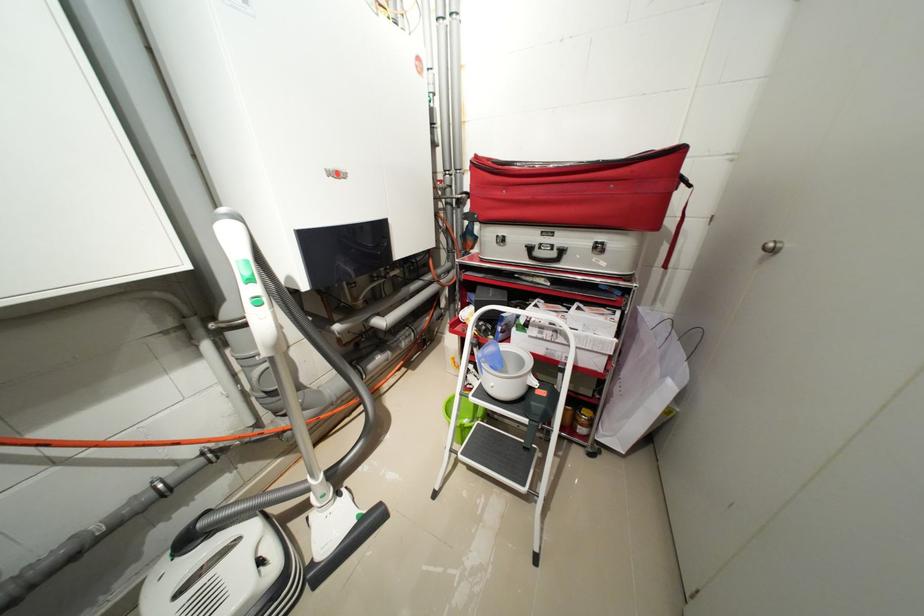
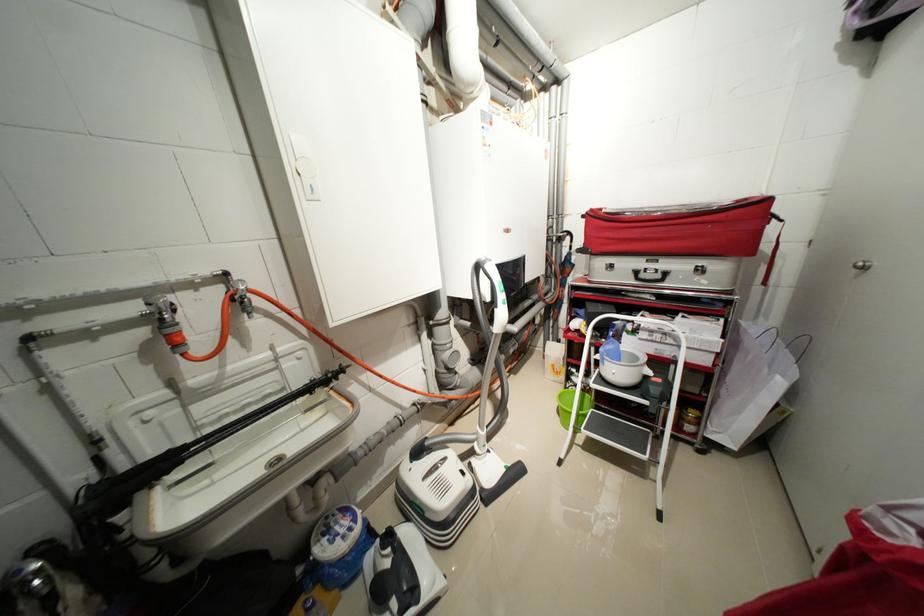
Where in the second image is the point corresponding to the point at 483,158 from the first image?

(599, 211)